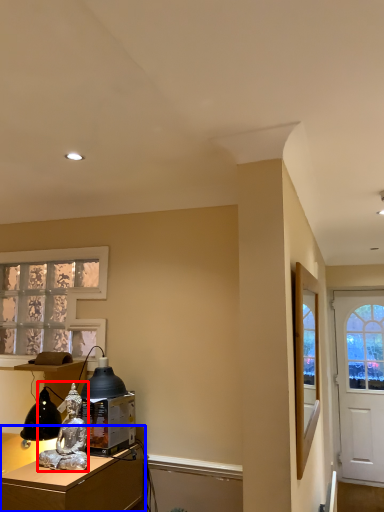
Question: Which of the following is the farthest to the observer, person (highlighted by a red box) or desk (highlighted by a blue box)?

Choices:
 (A) person
 (B) desk

Answer: (A)